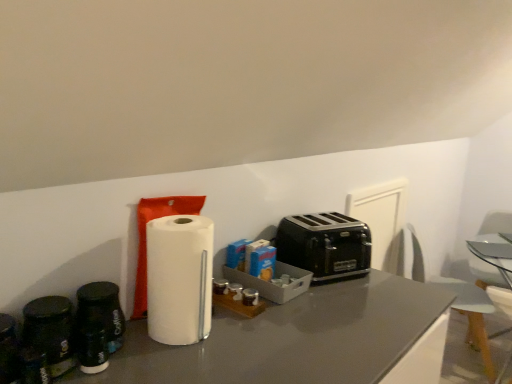
Question: Does white plastic swivel chair at right, acting as the 2th swivel chair starting from the left, have a smaller size compared to black metallic toaster at center?

Choices:
 (A) no
 (B) yes

Answer: (A)

Question: Is white plastic swivel chair at right, which appears as the first swivel chair when viewed from the right, to the left of black metallic toaster at center from the viewer's perspective?

Choices:
 (A) yes
 (B) no

Answer: (B)

Question: Is white plastic swivel chair at right, which appears as the first swivel chair when viewed from the right, aimed at black metallic toaster at center?

Choices:
 (A) yes
 (B) no

Answer: (B)

Question: Are white plastic swivel chair at right, acting as the 2th swivel chair starting from the left, and black metallic toaster at center making contact?

Choices:
 (A) yes
 (B) no

Answer: (B)

Question: Is white plastic swivel chair at right, which appears as the first swivel chair when viewed from the right, wider than black metallic toaster at center?

Choices:
 (A) yes
 (B) no

Answer: (A)

Question: From the image's perspective, is white plastic swivel chair at right, which appears as the first swivel chair when viewed from the right, over black metallic toaster at center?

Choices:
 (A) yes
 (B) no

Answer: (B)

Question: From the image's perspective, is black metallic toaster at center located above black matte coffee canister at left?

Choices:
 (A) no
 (B) yes

Answer: (B)

Question: Does black metallic toaster at center have a smaller size compared to black matte coffee canister at left?

Choices:
 (A) no
 (B) yes

Answer: (A)

Question: Considering the relative sizes of black metallic toaster at center and black matte coffee canister at left in the image provided, is black metallic toaster at center wider than black matte coffee canister at left?

Choices:
 (A) no
 (B) yes

Answer: (B)

Question: From the image's perspective, does black metallic toaster at center appear lower than black matte coffee canister at left?

Choices:
 (A) yes
 (B) no

Answer: (B)

Question: Is black metallic toaster at center not inside black matte coffee canister at left?

Choices:
 (A) yes
 (B) no

Answer: (A)

Question: Considering the relative positions of black metallic toaster at center and black matte coffee canister at left in the image provided, is black metallic toaster at center to the right of black matte coffee canister at left from the viewer's perspective?

Choices:
 (A) yes
 (B) no

Answer: (A)

Question: Is clear glass table at center not within white plastic swivel chair at right, the 2th swivel chair positioned from the right?

Choices:
 (A) yes
 (B) no

Answer: (B)